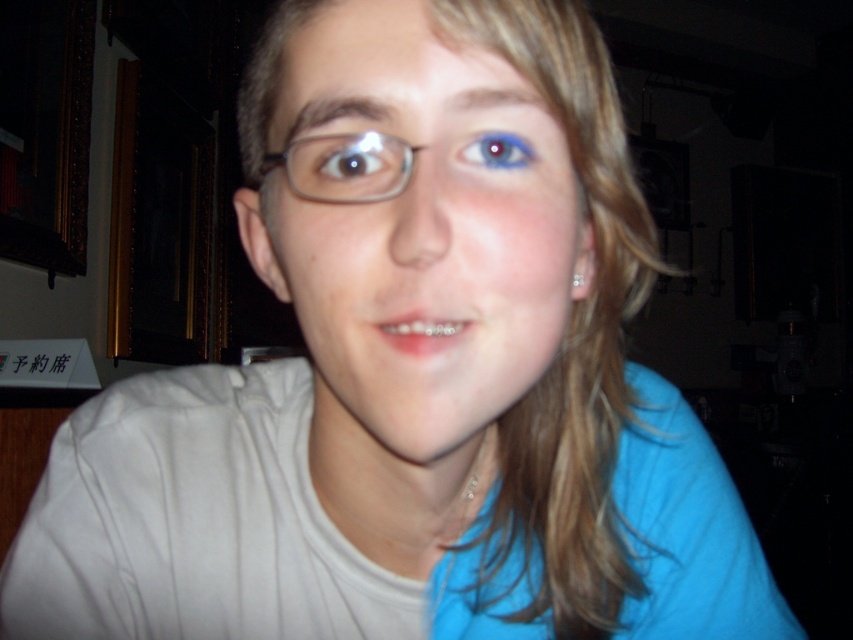
You are a photographer adjusting lighting for a portrait. The subject has a matte plastic face at center and a blue matte eye at center. To ensure proper focus, you need to know which object is wider. Which one is wider?

The matte plastic face at center is wider than the blue matte eye at center according to the description.